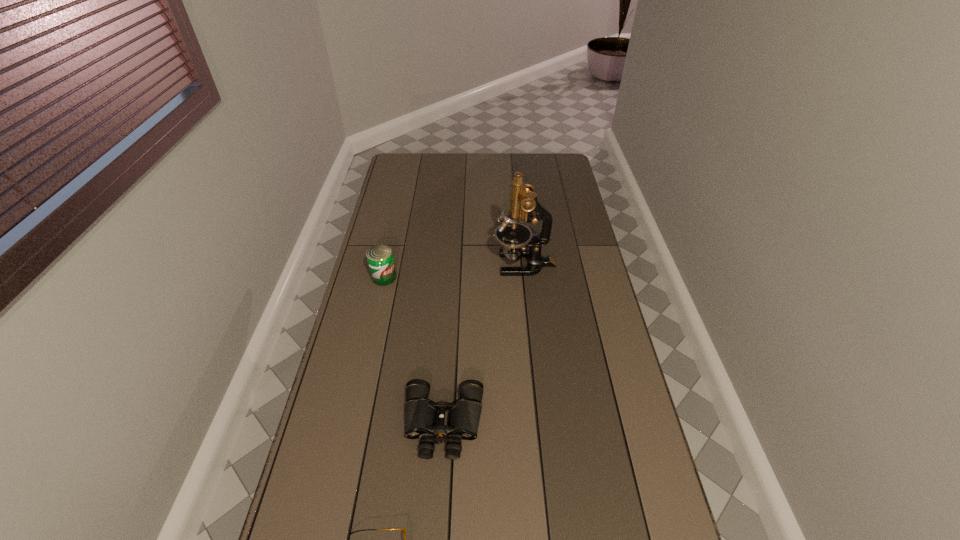
Locate an element on the screen. the rightmost object is located at coordinates (515, 237).

What are the coordinates of `the tallest object` in the screenshot? It's located at (515, 237).

Locate an element on the screen. This screenshot has width=960, height=540. can is located at coordinates (380, 259).

The image size is (960, 540). Find the location of `the second tallest object`. the second tallest object is located at coordinates 380,259.

I want to click on the second shortest object, so click(x=420, y=412).

Find the location of a particular element. binoculars is located at coordinates (420, 412).

At what (x,y) coordinates should I click in order to perform the action: click on vacant space situated 0.160m at the eyepiece of the rightmost object. Please return your answer as a coordinate pair (x, y). The image size is (960, 540). Looking at the image, I should click on (452, 264).

Image resolution: width=960 pixels, height=540 pixels. I want to click on vacant space located at the eyepiece of the rightmost object, so click(432, 264).

This screenshot has height=540, width=960. What are the coordinates of `vacant position located 0.120m at the eyepiece of the rightmost object` in the screenshot? It's located at (462, 264).

Find the location of a particular element. The height and width of the screenshot is (540, 960). vacant space situated on the front of the third shortest object is located at coordinates (362, 377).